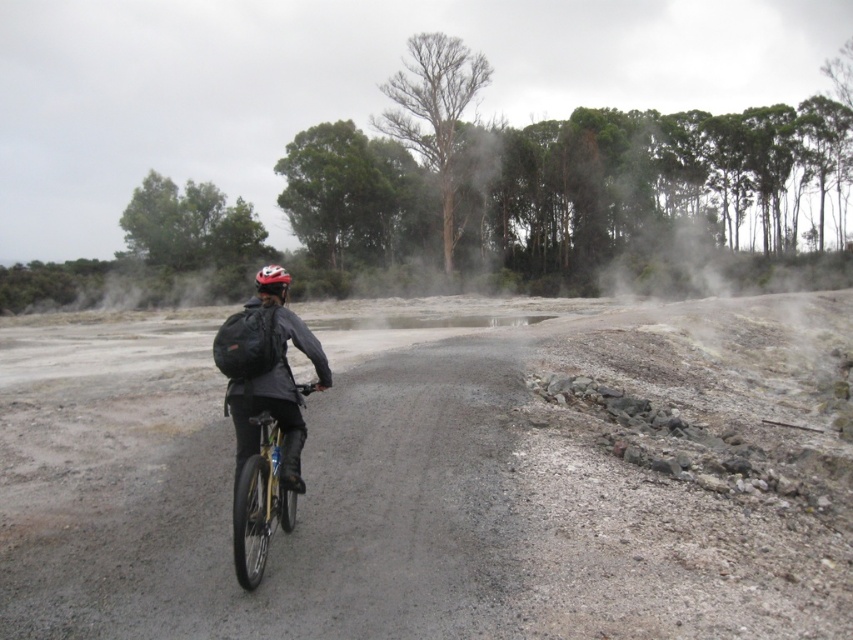
Which is behind, point (827, 628) or point (317, 387)?

The point (317, 387) is more distant.

Measure the distance between point (x=190, y=545) and camera.

A distance of 5.32 meters exists between point (x=190, y=545) and camera.

Is point (70, 356) less distant than point (312, 339)?

No, (70, 356) is further to viewer.

Locate an element on the screen. The height and width of the screenshot is (640, 853). gray gravel road at center is located at coordinates (433, 481).

Who is shorter, gold metallic bicycle at center or matte black helmet at center?

Standing shorter between the two is gold metallic bicycle at center.

Which is more to the right, gold metallic bicycle at center or matte black helmet at center?

gold metallic bicycle at center is more to the right.

The image size is (853, 640). What do you see at coordinates (259, 502) in the screenshot? I see `gold metallic bicycle at center` at bounding box center [259, 502].

Find the location of `gold metallic bicycle at center`. gold metallic bicycle at center is located at coordinates (259, 502).

Is point (91, 538) positioned in front of point (247, 476)?

No, it is behind (247, 476).

Is gray gravel road at center to the left of gold metallic bicycle at center from the viewer's perspective?

In fact, gray gravel road at center is to the right of gold metallic bicycle at center.

Locate an element on the screen. The width and height of the screenshot is (853, 640). gray gravel road at center is located at coordinates (433, 481).

This screenshot has width=853, height=640. In order to click on gray gravel road at center in this screenshot , I will do `click(433, 481)`.